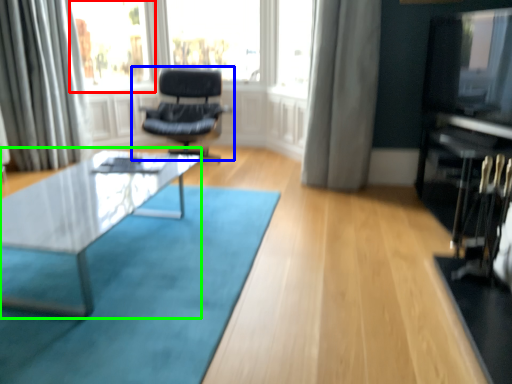
Question: Which object is the closest to the bay window (highlighted by a red box)? Choose among these: chair (highlighted by a blue box) or coffee table (highlighted by a green box).

Choices:
 (A) chair
 (B) coffee table

Answer: (A)